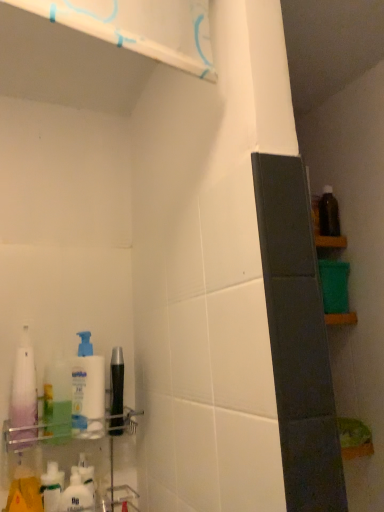
Question: Would you say translucent purple bottle at left, which is counted as the first cleaning product, starting from the left, contains white glossy shelf at upper left, the second shelf in the back-to-front sequence?

Choices:
 (A) yes
 (B) no

Answer: (B)

Question: Is translucent purple bottle at left, which is counted as the first cleaning product, starting from the left, bigger than white glossy shelf at upper left, which is counted as the first shelf, starting from the front?

Choices:
 (A) no
 (B) yes

Answer: (A)

Question: Does translucent purple bottle at left, which is counted as the first cleaning product, starting from the left, have a greater width compared to white glossy shelf at upper left, which is counted as the first shelf, starting from the front?

Choices:
 (A) no
 (B) yes

Answer: (B)

Question: Can you confirm if translucent purple bottle at left, marked as the 3th cleaning product in a right-to-left arrangement, is shorter than white glossy shelf at upper left, which is counted as the first shelf, starting from the front?

Choices:
 (A) yes
 (B) no

Answer: (B)

Question: Is translucent purple bottle at left, which is counted as the first cleaning product, starting from the left, located outside white glossy shelf at upper left, the 2th shelf ordered from the bottom?

Choices:
 (A) no
 (B) yes

Answer: (B)

Question: From a real-world perspective, is translucent purple bottle at left, which is counted as the first cleaning product, starting from the left, located beneath white glossy shelf at upper left, the first shelf from the top?

Choices:
 (A) no
 (B) yes

Answer: (B)

Question: Is white matte pump bottle at left, the first cleaning product positioned from the right, at the back of white glossy pump bottle at left, which is the second cleaning product in left-to-right order?

Choices:
 (A) no
 (B) yes

Answer: (A)

Question: Considering the relative positions of white glossy pump bottle at left, arranged as the 2th cleaning product when viewed from the right, and white matte pump bottle at left, the first cleaning product positioned from the right, in the image provided, is white glossy pump bottle at left, arranged as the 2th cleaning product when viewed from the right, to the left of white matte pump bottle at left, the first cleaning product positioned from the right, from the viewer's perspective?

Choices:
 (A) no
 (B) yes

Answer: (B)

Question: Considering the relative sizes of white glossy pump bottle at left, arranged as the 2th cleaning product when viewed from the right, and white matte pump bottle at left, the first cleaning product positioned from the right, in the image provided, is white glossy pump bottle at left, arranged as the 2th cleaning product when viewed from the right, shorter than white matte pump bottle at left, the first cleaning product positioned from the right,?

Choices:
 (A) yes
 (B) no

Answer: (B)

Question: Is white glossy pump bottle at left, arranged as the 2th cleaning product when viewed from the right, far from white matte pump bottle at left, the first cleaning product positioned from the right?

Choices:
 (A) yes
 (B) no

Answer: (B)

Question: Is white matte pump bottle at left, the first cleaning product positioned from the right, inside white glossy pump bottle at left, which is the second cleaning product in left-to-right order?

Choices:
 (A) yes
 (B) no

Answer: (B)

Question: From the image's perspective, is white glossy pump bottle at left, arranged as the 2th cleaning product when viewed from the right, below white matte pump bottle at left, positioned as the 3th cleaning product in left-to-right order?

Choices:
 (A) yes
 (B) no

Answer: (B)

Question: Can you confirm if white glossy shelf at upper left, the 2th shelf ordered from the bottom, is positioned to the right of clear plastic shelf at lower left, arranged as the 1th shelf when ordered from the bottom?

Choices:
 (A) yes
 (B) no

Answer: (A)